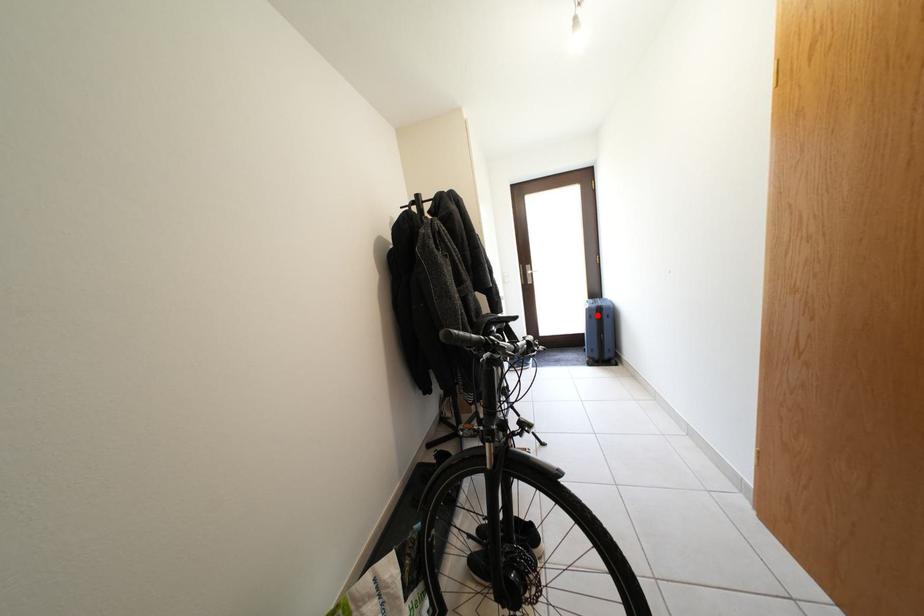
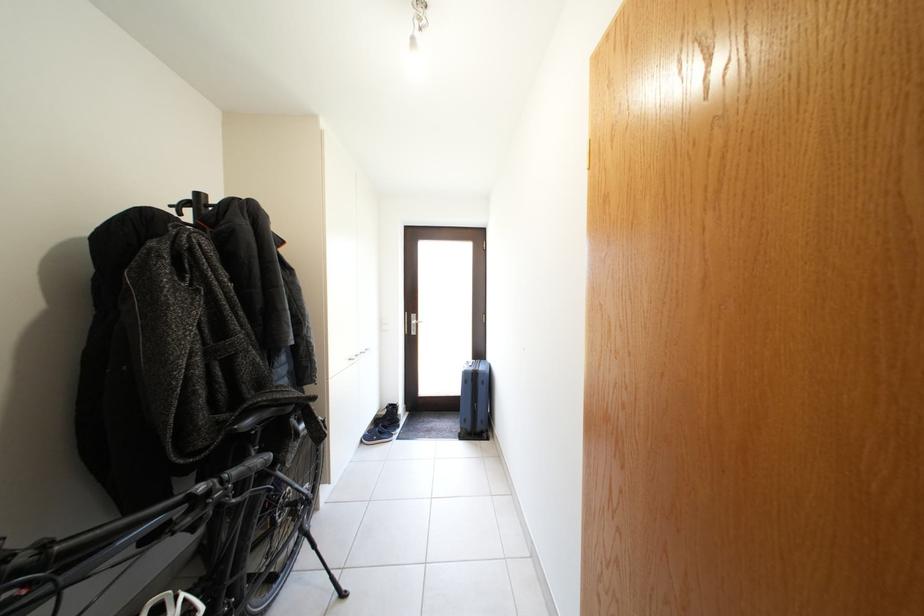
Find the pixel in the second image that matches the highlighted location in the first image.

(473, 379)